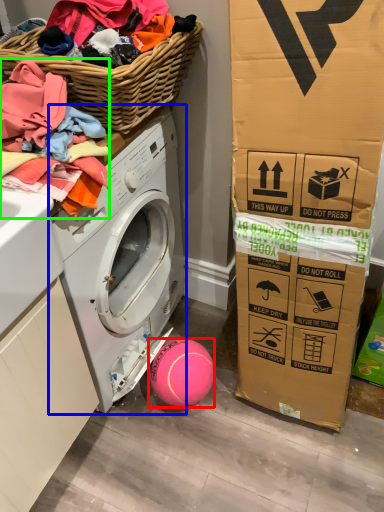
Question: Which is nearer to the ball (highlighted by a red box)? washing machine (highlighted by a blue box) or clothing (highlighted by a green box).

Choices:
 (A) washing machine
 (B) clothing

Answer: (A)